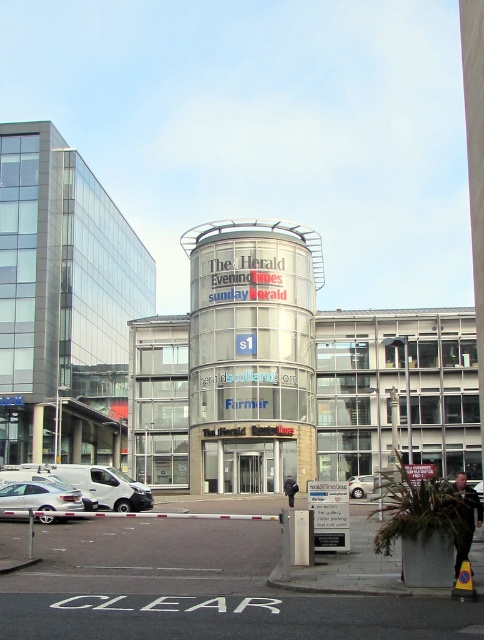
Does silver metallic car at lower left appear over silver metallic car at center?

Yes, silver metallic car at lower left is above silver metallic car at center.

Measure the distance between point (94, 499) and camera.

The distance of point (94, 499) from camera is 112.59 feet.

Describe the element at coordinates (31, 477) in the screenshot. The image size is (484, 640). I see `silver metallic car at lower left` at that location.

This screenshot has width=484, height=640. Identify the location of silver metallic car at lower left. (31, 477).

How much distance is there between silver metallic sedan at lower left and silver metallic car at lower left?

silver metallic sedan at lower left is 4.21 meters away from silver metallic car at lower left.

This screenshot has height=640, width=484. What do you see at coordinates (38, 499) in the screenshot?
I see `silver metallic sedan at lower left` at bounding box center [38, 499].

Which is in front, point (45, 515) or point (85, 506)?

Point (45, 515)

The height and width of the screenshot is (640, 484). I want to click on silver metallic sedan at lower left, so click(38, 499).

Who is more distant from viewer, (x=49, y=522) or (x=367, y=476)?

The point (x=367, y=476) is behind.

Which is behind, point (49, 488) or point (359, 476)?

The point (359, 476) is more distant.

Find the location of `silver metallic sedan at lower left`. silver metallic sedan at lower left is located at coordinates (38, 499).